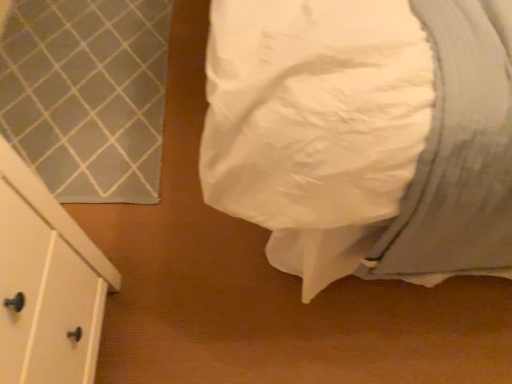
Find the location of `white smooth bedsheet at right`. white smooth bedsheet at right is located at coordinates point(458,154).

Measure the distance between white smooth bedsheet at right and camera.

25.09 inches.

Describe the element at coordinates (458, 154) in the screenshot. I see `white smooth bedsheet at right` at that location.

This screenshot has width=512, height=384. In order to click on white smooth bedsheet at right in this screenshot , I will do `click(458, 154)`.